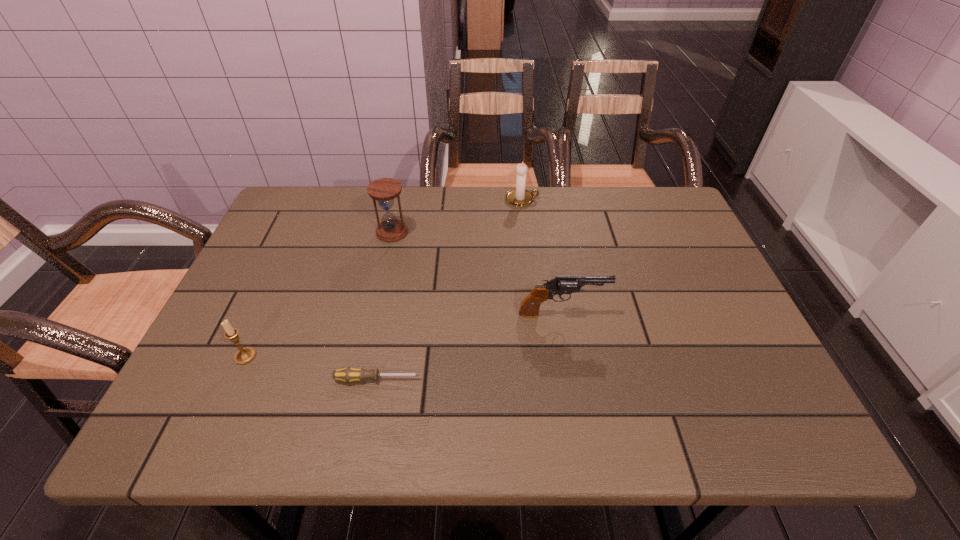
This screenshot has width=960, height=540. Find the location of `vacant area between the second nearest object and the nearest object`. vacant area between the second nearest object and the nearest object is located at coordinates (312, 368).

Where is `empty space between the leftmost object and the hourglass`? empty space between the leftmost object and the hourglass is located at coordinates (319, 294).

Choose which object is the third nearest neighbor to the gun. Please provide its 2D coordinates. Your answer should be formatted as a tuple, i.e. [(x, y)], where the tuple contains the x and y coordinates of a point satisfying the conditions above.

[(520, 196)]

The image size is (960, 540). What are the coordinates of `object that is the third closest to the hourglass` in the screenshot? It's located at (245, 355).

Identify the location of free location that satisfies the following two spatial constraints: 1. on the back side of the second nearest object; 2. on the right side of the hourglass. [x=301, y=232].

Locate an element on the screen. The height and width of the screenshot is (540, 960). vacant region that satisfies the following two spatial constraints: 1. on the back side of the left candle holder; 2. on the right side of the hourglass is located at coordinates (301, 232).